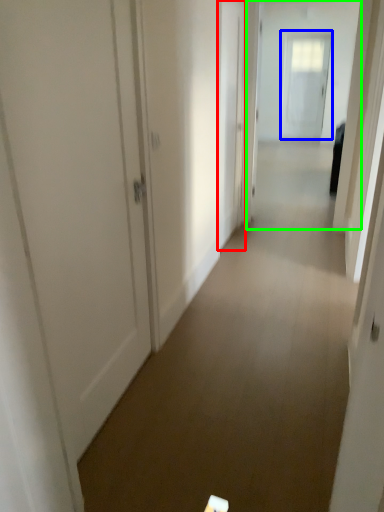
Question: Which object is positioned farthest from door (highlighted by a red box)? Select from door (highlighted by a blue box) and passage (highlighted by a green box).

Choices:
 (A) door
 (B) passage

Answer: (A)